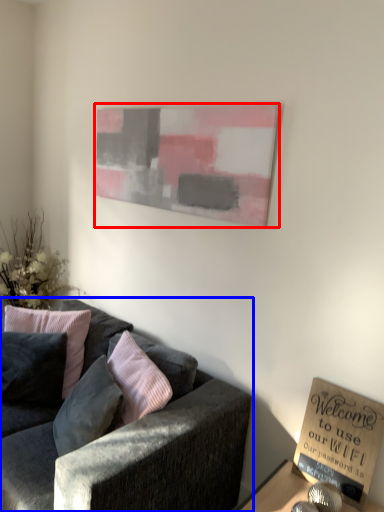
Question: Which object is further to the camera taking this photo, picture frame (highlighted by a red box) or studio couch (highlighted by a blue box)?

Choices:
 (A) picture frame
 (B) studio couch

Answer: (A)